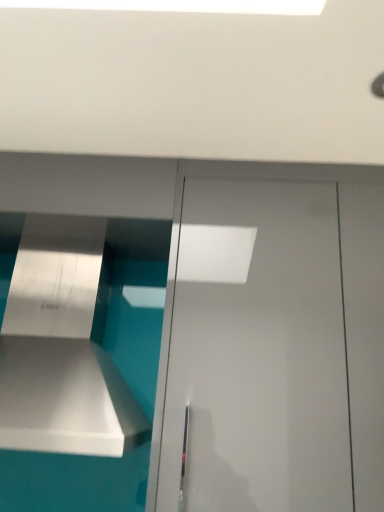
Locate an element on the screen. empty space that is ontop of metallic silver vent at left (from a real-world perspective) is located at coordinates (74, 222).